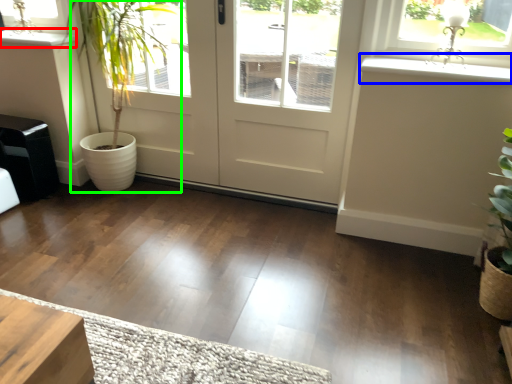
Question: Which is farther away from window sill (highlighted by a red box)? window sill (highlighted by a blue box) or houseplant (highlighted by a green box)?

Choices:
 (A) window sill
 (B) houseplant

Answer: (A)